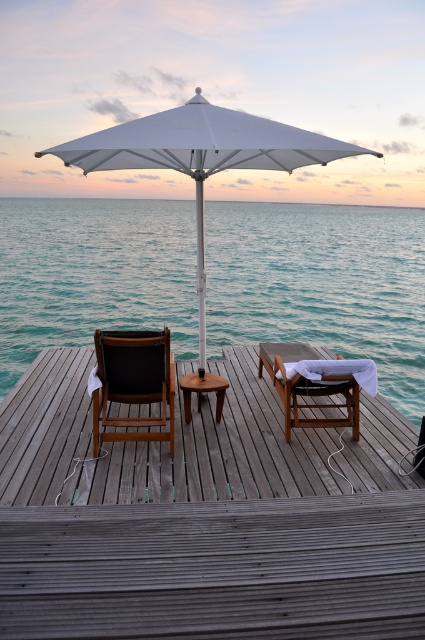
Looking at this image, you are standing on the wooden deck and want to place a 10 feet long wooden bench between the wooden at center and the white fabric umbrella at center. Is there enough space?

The distance between the wooden at center and the white fabric umbrella at center is 8.03 feet. Since the bench is 10 feet long, which is longer than the available space, it won measurements. Therefore, there is not enough space to place the bench between them.

You are planning to install a new light fixture between the wooden at center and the white fabric umbrella at center. Considering their heights, which object should the light fixture be attached to if you want it to be higher?

The white fabric umbrella at center is taller than the wooden at center, so the light fixture should be attached to the white fabric umbrella at center to achieve a higher placement.

You are standing at the edge of the wooden deck and want to place a small potted plant between the two points marked as point [170,412] and point [221,401]. Which point should the plant be closer to if you want it to be nearer to the viewer?

The plant should be placed closer to point [170,412] because it is closer to the viewer than point [221,401].